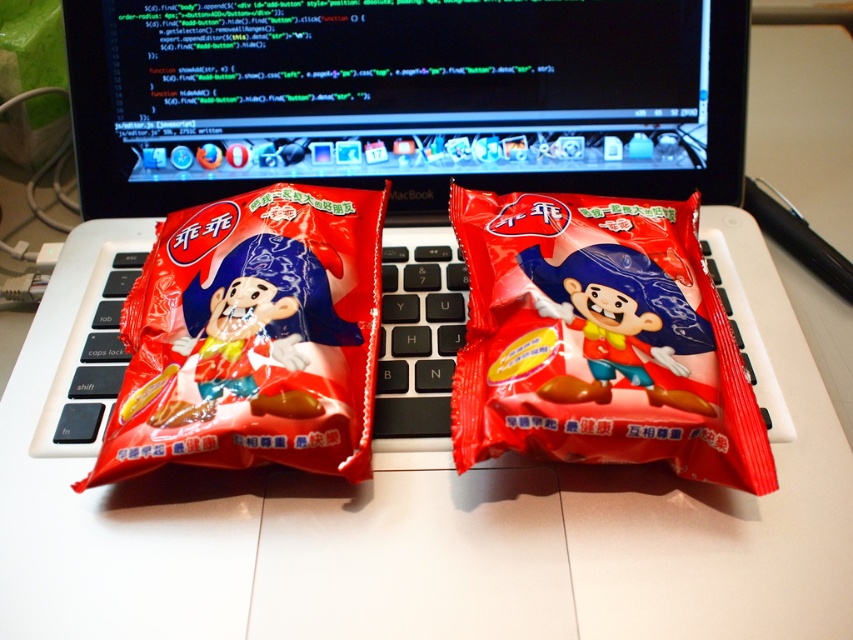
Question: Which point is closer to the camera?

Choices:
 (A) matte black laptop at center
 (B) black plastic keyboard at center
 (C) matte plastic snack at center

Answer: (C)

Question: Can you confirm if matte black laptop at center is positioned above matte plastic snack at left?

Choices:
 (A) yes
 (B) no

Answer: (A)

Question: Based on their relative distances, which object is nearer to the matte plastic snack at center?

Choices:
 (A) black plastic keyboard at center
 (B) matte black laptop at center

Answer: (B)

Question: Can you confirm if matte black laptop at center is smaller than matte plastic snack at center?

Choices:
 (A) yes
 (B) no

Answer: (B)

Question: Can you confirm if matte black laptop at center is wider than matte plastic snack at left?

Choices:
 (A) yes
 (B) no

Answer: (A)

Question: Which of the following is the farthest from the observer?

Choices:
 (A) matte black laptop at center
 (B) matte plastic snack at left

Answer: (A)